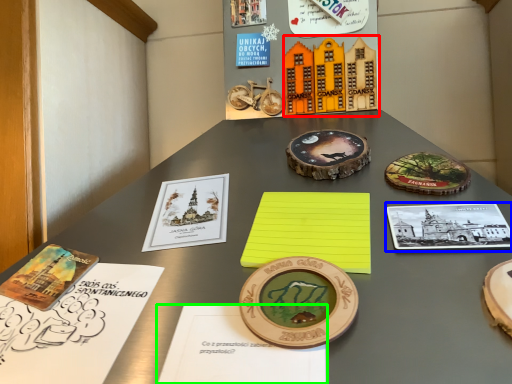
Question: Estimate the real-world distances between objects in this image. Which object is farther from toy (highlighted by a red box), book (highlighted by a blue box) or notebook (highlighted by a green box)?

Choices:
 (A) book
 (B) notebook

Answer: (B)